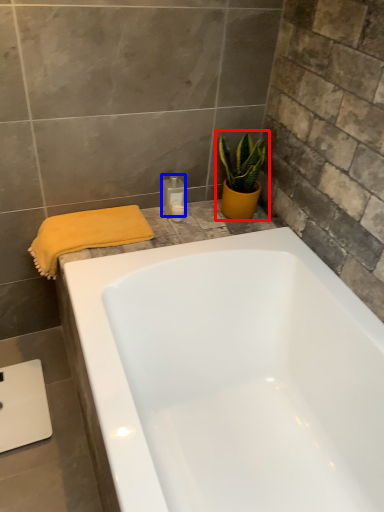
Question: Which object appears closest to the camera in this image, houseplant (highlighted by a red box) or toiletry (highlighted by a blue box)?

Choices:
 (A) houseplant
 (B) toiletry

Answer: (A)